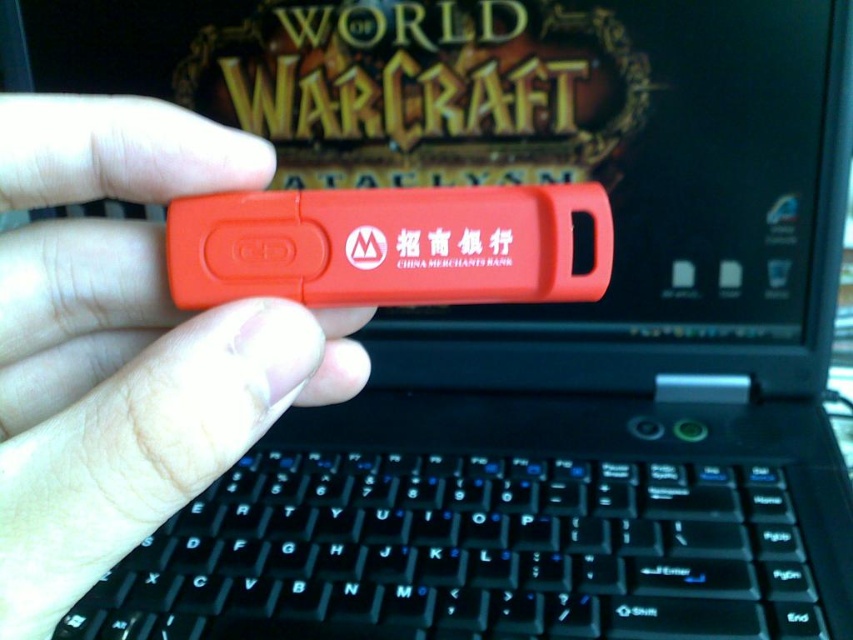
You are trying to determine if the black plastic keyboard at center can be placed on top of the matte plastic usb drive at center without falling off. Based on their sizes, is this possible?

The black plastic keyboard at center is not as tall as matte plastic usb drive at center, so it might be possible to place the keyboard on top of the USB drive. However, since keyboards are typically larger and heavier than USB drives, this might not be stable and could cause the USB drive to tip over.

Consider the image. You are a delivery robot with a 12 inch wide arm. You need to place an item between the black plastic keyboard at center and the matte plastic usb drive at center. Can your arm fit in the space between them?

The black plastic keyboard at center and the matte plastic usb drive at center are 10.04 inches apart. Since your arm is 12 inches wide, it cannot fit in the space between them.

You are a person with a 16.5 inch long arm. You want to type on the black plastic keyboard at center while holding the red USB flash drive in your right hand. Can you reach the keyboard without moving your arm?

The black plastic keyboard at center and viewer are 18.20 inches apart from each other. Since your arm is only 16.5 inches long, you cannot reach the keyboard without moving your arm.